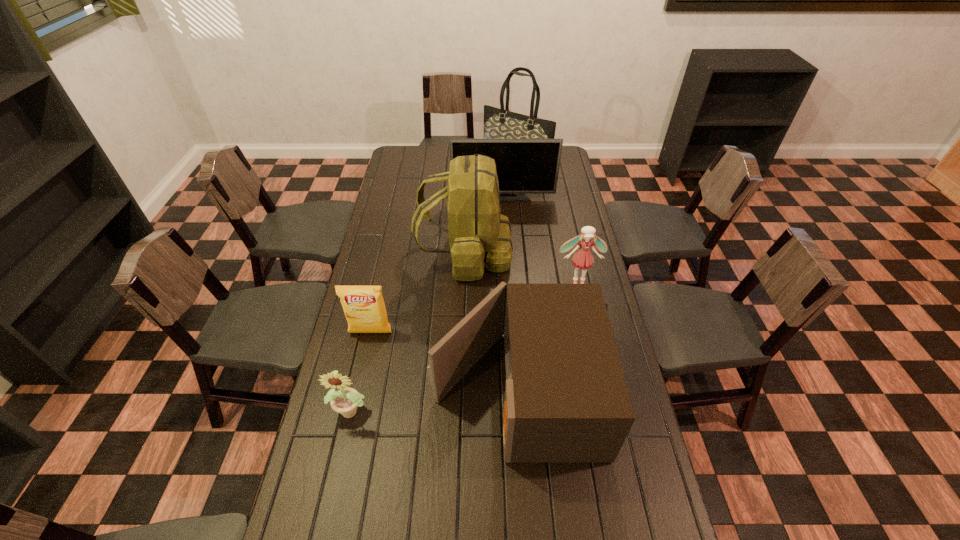
At what (x,y) coordinates should I click in order to perform the action: click on unoccupied area between the backpack and the doll. Please return your answer as a coordinate pair (x, y). Looking at the image, I should click on (521, 268).

Locate which object ranks fifth in proximity to the farthest object. Please provide its 2D coordinates. Your answer should be formatted as a tuple, i.e. [(x, y)], where the tuple contains the x and y coordinates of a point satisfying the conditions above.

[(364, 308)]

Locate which object ranks third in proximity to the sixth nearest object. Please provide its 2D coordinates. Your answer should be formatted as a tuple, i.e. [(x, y)], where the tuple contains the x and y coordinates of a point satisfying the conditions above.

[(583, 259)]

Find the location of `vacant region that satisfies the following two spatial constraints: 1. on the screen side of the second farthest object; 2. with the door open on the front of the microwave oven`. vacant region that satisfies the following two spatial constraints: 1. on the screen side of the second farthest object; 2. with the door open on the front of the microwave oven is located at coordinates pyautogui.click(x=516, y=390).

This screenshot has height=540, width=960. Find the location of `blank space that satisfies the following two spatial constraints: 1. on the screen side of the monitor; 2. with the door open on the front of the microwave oven`. blank space that satisfies the following two spatial constraints: 1. on the screen side of the monitor; 2. with the door open on the front of the microwave oven is located at coordinates (516, 390).